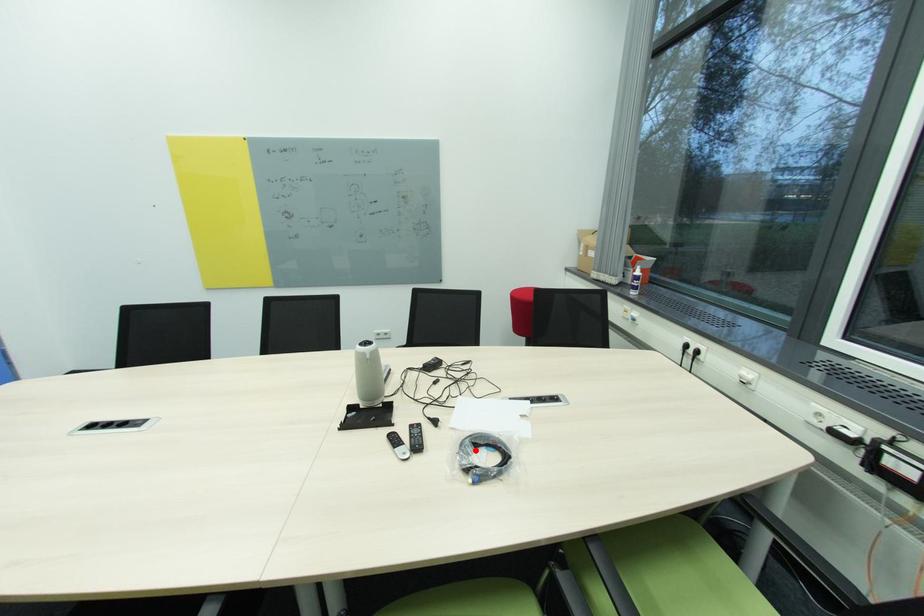
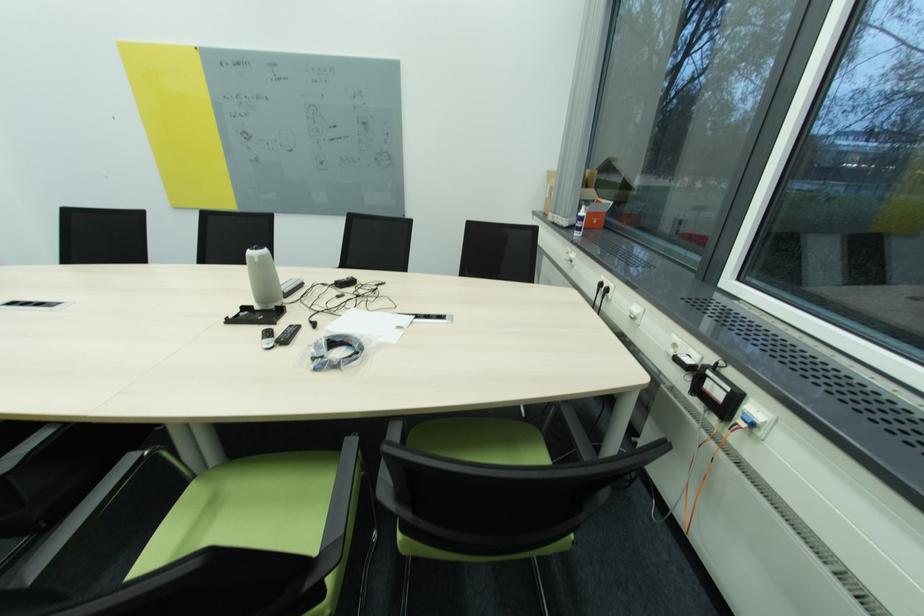
Find the pixel in the second image that matches the highlighted location in the first image.

(327, 345)